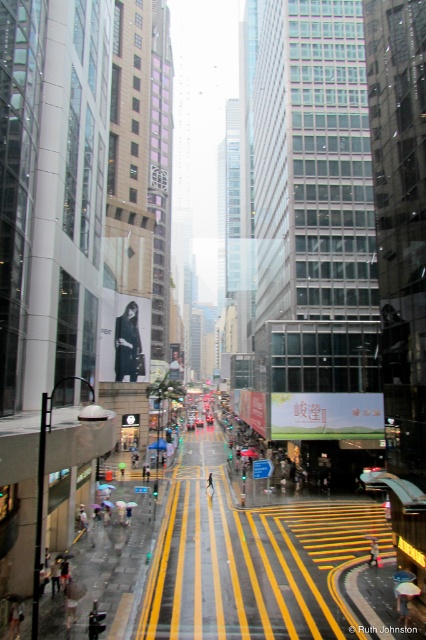
Can you confirm if dark fabric coat at center is wider than raincoat fabric person at center?

Yes, dark fabric coat at center is wider than raincoat fabric person at center.

Is point (117, 360) positioned before point (377, 552)?

No, (117, 360) is behind (377, 552).

The width and height of the screenshot is (426, 640). What are the coordinates of `dark fabric coat at center` in the screenshot? It's located at (127, 344).